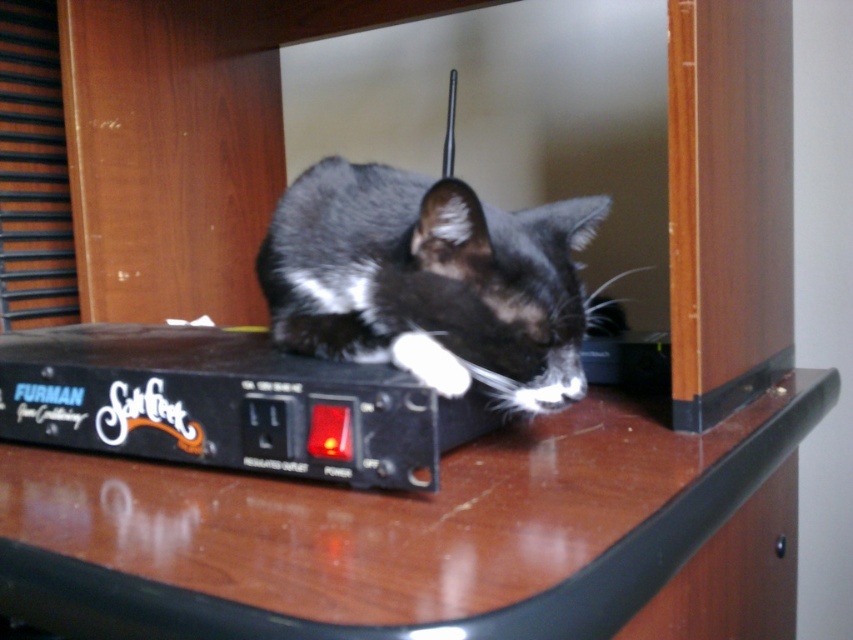
Question: Is brown glossy table at center to the right of black fur cat at center from the viewer's perspective?

Choices:
 (A) yes
 (B) no

Answer: (A)

Question: Which point is farther to the camera?

Choices:
 (A) brown glossy table at center
 (B) black fur cat at center
 (C) white fluffy paw at center

Answer: (C)

Question: Which object appears closest to the camera in this image?

Choices:
 (A) black fur cat at center
 (B) brown glossy table at center
 (C) white fluffy paw at center

Answer: (B)

Question: Can you confirm if black fur cat at center is wider than white fluffy paw at center?

Choices:
 (A) no
 (B) yes

Answer: (B)

Question: Does brown glossy table at center come in front of white fluffy paw at center?

Choices:
 (A) yes
 (B) no

Answer: (A)

Question: Considering the real-world distances, which object is farthest from the white fluffy paw at center?

Choices:
 (A) brown glossy table at center
 (B) black fur cat at center

Answer: (A)